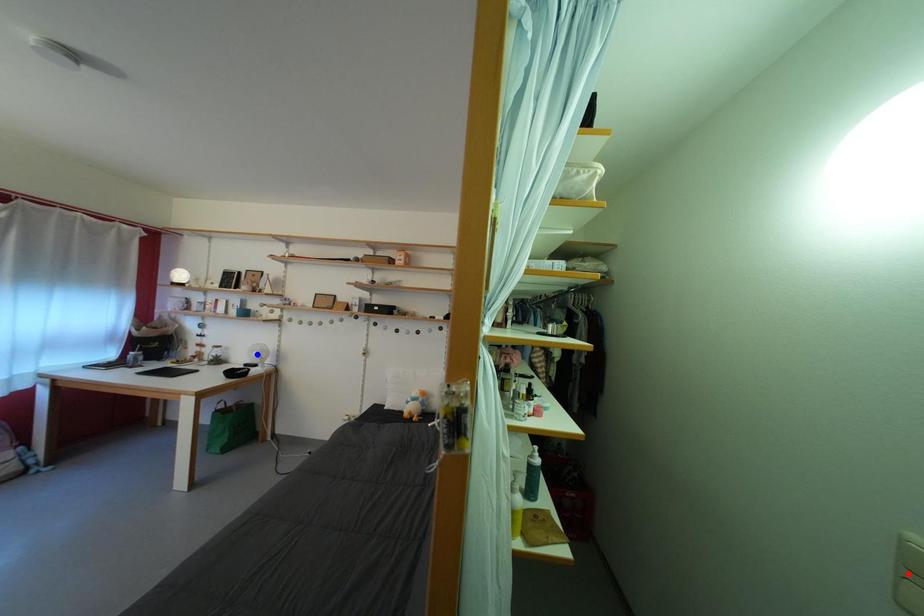
Question: In the image, two points are highlighted. Which point is nearer to the camera? Reply with the corresponding letter.

Choices:
 (A) blue point
 (B) red point

Answer: (B)